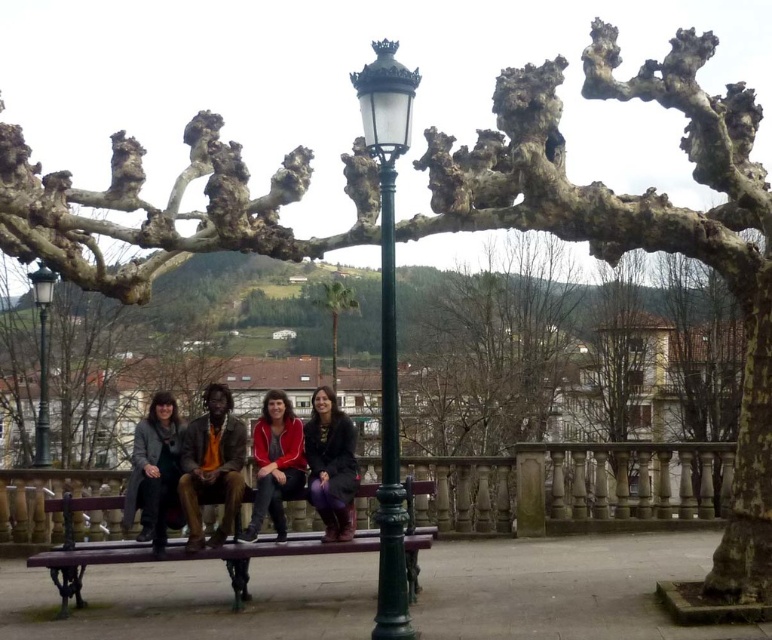
You are a photographer wanting to capture a group photo of the four people on the bench. You notice the green metal pole at center and the dark gray coat at left in the background. Which object should you adjust to avoid blocking the main subjects?

The green metal pole at center is larger in size than the dark gray coat at left, so you should adjust the green metal pole at center to avoid blocking the main subjects since it is bigger and more likely to obstruct the view.

You are standing at the center of the bench and want to reach the green metal pole at center. Which direction should you move to reach it?

The green metal pole at center is located at point (388, 435), so you should move towards the center of the bench to reach it.

You are a photographer trying to capture a photo of the wooden bench at center without the green metal street light at left appearing in the background. Based on their positions, do you think this is possible?

The wooden bench at center is in front of the green metal street light at left, so if you position yourself so that the bench blocks the view of the street light, it should be possible to take a photo where the bench is visible without the street light in the background.